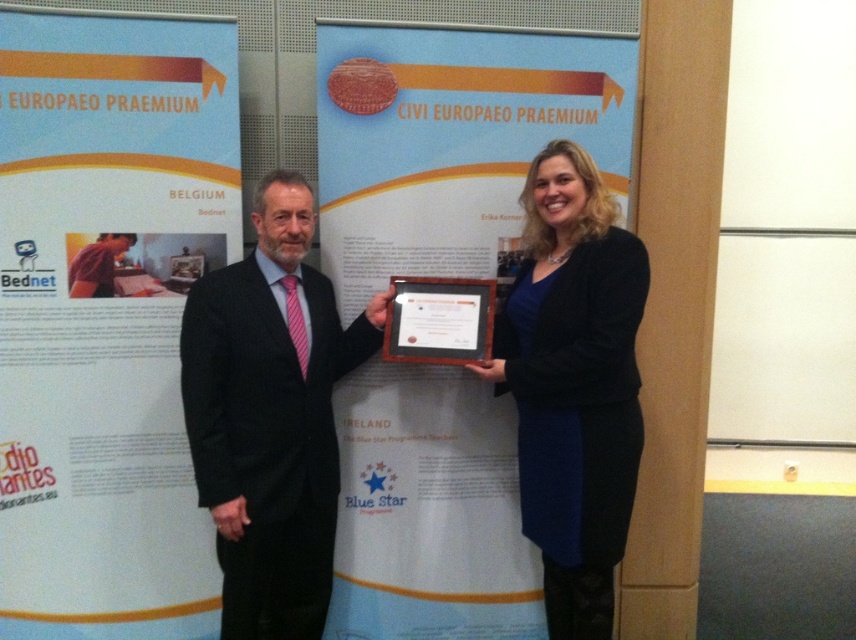
Between point (120, 266) and point (280, 232), which one is positioned behind?

Positioned behind is point (120, 266).

Is white paperboard poster at upper left thinner than black suit at center?

Incorrect, white paperboard poster at upper left's width is not less than black suit at center's.

Who is more distant from viewer, [152,58] or [327,552]?

Point [152,58]

The width and height of the screenshot is (856, 640). In order to click on white paperboard poster at upper left in this screenshot , I will do `click(107, 314)`.

This screenshot has height=640, width=856. Describe the element at coordinates (452, 140) in the screenshot. I see `white paperboard at center` at that location.

Is point (627, 72) positioned after point (490, 364)?

Yes.

Who is more distant from viewer, [403,58] or [536,520]?

The point [403,58] is behind.

At what (x,y) coordinates should I click in order to perform the action: click on white paperboard at center. Please return your answer as a coordinate pair (x, y). Looking at the image, I should click on (452, 140).

Between point (226, 195) and point (456, 579), which one is positioned in front?

Point (226, 195) is more forward.

Which of these two, white paperboard poster at upper left or white paperboard at center, stands taller?

white paperboard at center

Between point (76, 224) and point (599, 156), which one is positioned in front?

Point (76, 224) is in front.

You are a GUI agent. You are given a task and a screenshot of the screen. Output one action in this format:
    pyautogui.click(x=<x>, y=<y>)
    Task: Click on the white paperboard poster at upper left
    The height and width of the screenshot is (640, 856).
    Given the screenshot: What is the action you would take?
    pyautogui.click(x=107, y=314)